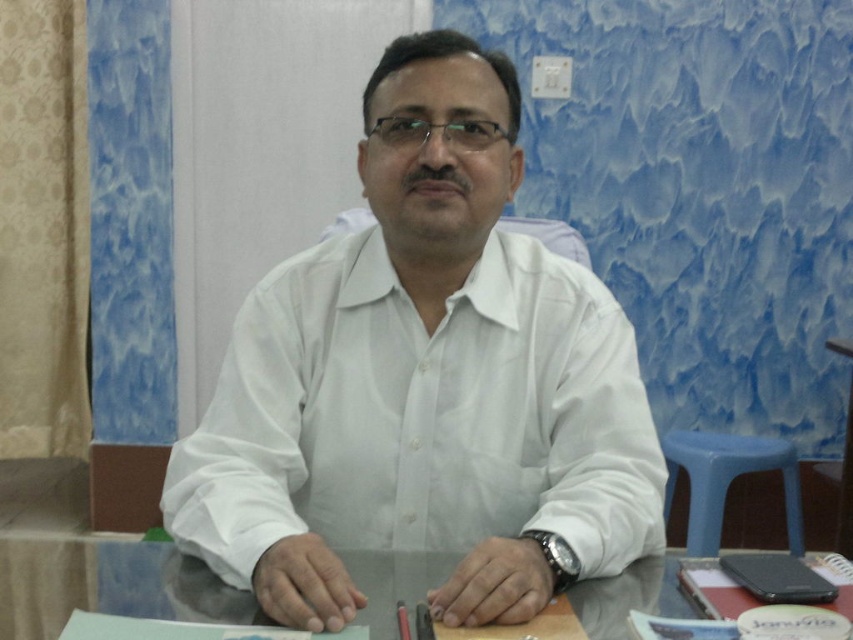
Question: Can you confirm if white smooth shirt at center is positioned to the left of transparent glass table at center?

Choices:
 (A) no
 (B) yes

Answer: (A)

Question: Among these points, which one is nearest to the camera?

Choices:
 (A) (485, 244)
 (B) (120, 584)

Answer: (B)

Question: In this image, where is white smooth shirt at center located relative to transparent glass table at center?

Choices:
 (A) left
 (B) right

Answer: (B)

Question: Which of the following is the closest to the observer?

Choices:
 (A) transparent glass table at center
 (B) white smooth shirt at center

Answer: (B)

Question: From the image, what is the correct spatial relationship of white smooth shirt at center in relation to transparent glass table at center?

Choices:
 (A) below
 (B) above

Answer: (B)